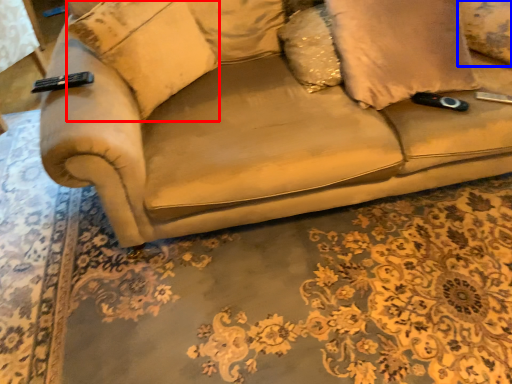
Question: Which of the following is the closest to the observer, pillow (highlighted by a red box) or pillow (highlighted by a blue box)?

Choices:
 (A) pillow
 (B) pillow

Answer: (A)